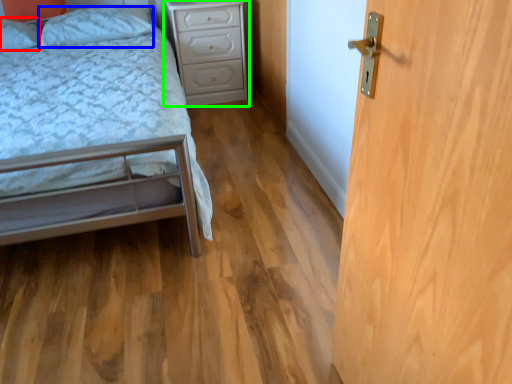
Question: Estimate the real-world distances between objects in this image. Which object is closer to pillow (highlighted by a red box), pillow (highlighted by a blue box) or nightstand (highlighted by a green box)?

Choices:
 (A) pillow
 (B) nightstand

Answer: (A)